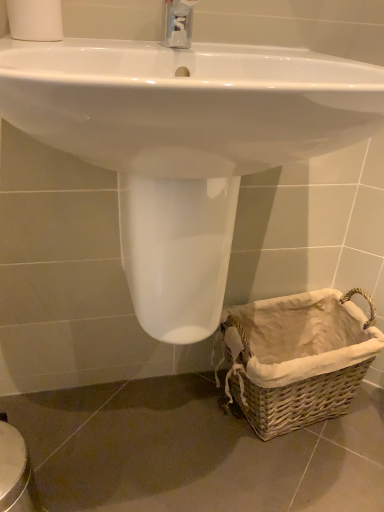
Question: Is white matte toilet paper at upper left at the right side of woven brown basket at lower right?

Choices:
 (A) yes
 (B) no

Answer: (B)

Question: Does white matte toilet paper at upper left have a greater height compared to woven brown basket at lower right?

Choices:
 (A) no
 (B) yes

Answer: (A)

Question: From a real-world perspective, is white matte toilet paper at upper left located higher than woven brown basket at lower right?

Choices:
 (A) yes
 (B) no

Answer: (A)

Question: Can you see white matte toilet paper at upper left touching woven brown basket at lower right?

Choices:
 (A) yes
 (B) no

Answer: (B)

Question: Is white matte toilet paper at upper left smaller than woven brown basket at lower right?

Choices:
 (A) no
 (B) yes

Answer: (B)

Question: Considering the positions of point (180, 298) and point (18, 13), is point (180, 298) closer or farther from the camera than point (18, 13)?

Choices:
 (A) closer
 (B) farther

Answer: (B)

Question: In terms of height, does white glossy sink at center look taller or shorter compared to white matte toilet paper at upper left?

Choices:
 (A) tall
 (B) short

Answer: (A)

Question: Relative to white matte toilet paper at upper left, is white glossy sink at center in front or behind?

Choices:
 (A) behind
 (B) front

Answer: (B)

Question: From the image's perspective, is white glossy sink at center positioned above or below white matte toilet paper at upper left?

Choices:
 (A) above
 (B) below

Answer: (B)

Question: Visually, is white matte toilet paper at upper left positioned to the left or to the right of white glossy sink at center?

Choices:
 (A) right
 (B) left

Answer: (B)

Question: In terms of size, does white matte toilet paper at upper left appear bigger or smaller than white glossy sink at center?

Choices:
 (A) small
 (B) big

Answer: (A)

Question: In terms of height, does white matte toilet paper at upper left look taller or shorter compared to white glossy sink at center?

Choices:
 (A) short
 (B) tall

Answer: (A)

Question: Looking at their shapes, would you say white matte toilet paper at upper left is wider or thinner than white glossy sink at center?

Choices:
 (A) thin
 (B) wide

Answer: (A)

Question: From the image's perspective, is white glossy sink at center above or below woven brown basket at lower right?

Choices:
 (A) above
 (B) below

Answer: (A)

Question: Is white glossy sink at center wider or thinner than woven brown basket at lower right?

Choices:
 (A) wide
 (B) thin

Answer: (A)